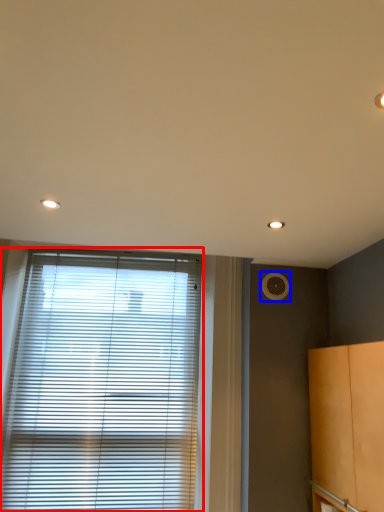
Question: Which point is closer to the camera, window blind (highlighted by a red box) or air conditioning (highlighted by a blue box)?

Choices:
 (A) window blind
 (B) air conditioning

Answer: (A)